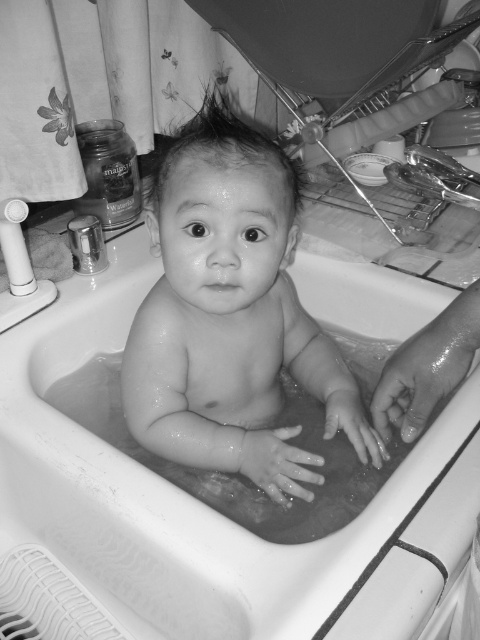
Is wet skin baby at center below wet skin hand at lower right?

No.

Can you confirm if wet skin baby at center is bigger than wet skin hand at lower right?

Yes.

Who is more distant from viewer, (133, 412) or (433, 376)?

Positioned behind is point (433, 376).

This screenshot has width=480, height=640. In order to click on wet skin baby at center in this screenshot , I will do `click(225, 310)`.

Can you confirm if wet skin baby at center is positioned to the right of smooth skin hand at center?

No, wet skin baby at center is not to the right of smooth skin hand at center.

Which is in front, point (149, 435) or point (346, 404)?

Point (149, 435)

Does point (225, 276) lie behind point (347, 413)?

No, it is in front of (347, 413).

The image size is (480, 640). What are the coordinates of `wet skin baby at center` in the screenshot? It's located at (225, 310).

Does wet skin hand at lower right have a lesser width compared to smooth skin hand at center?

No.

Identify the location of wet skin hand at lower right. The height and width of the screenshot is (640, 480). coord(423,372).